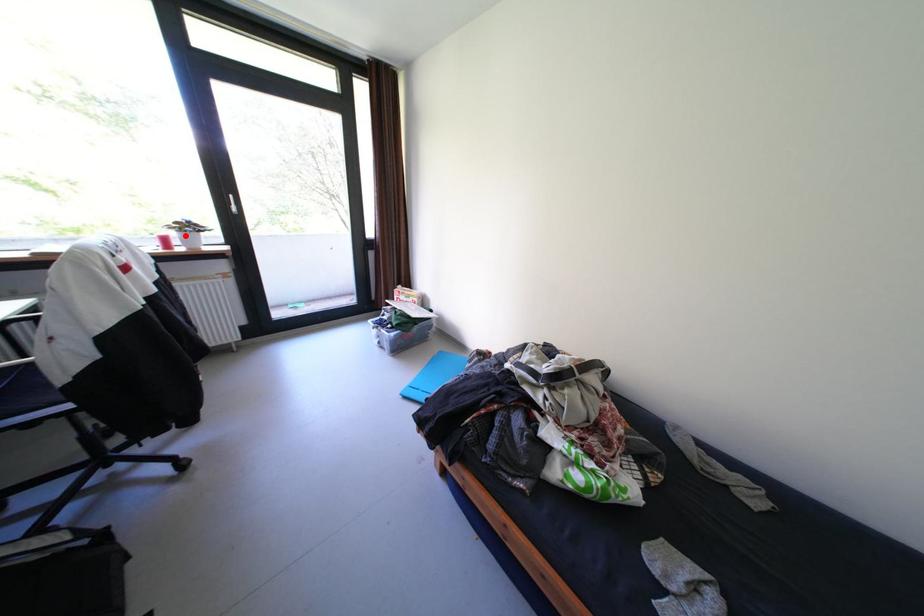
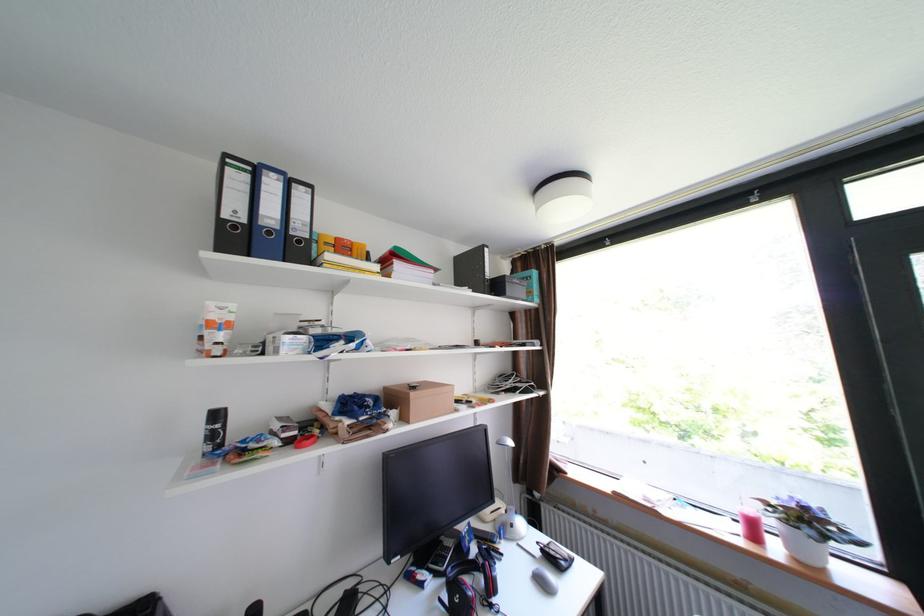
Find the pixel in the second image that matches the highlighted location in the first image.

(782, 523)